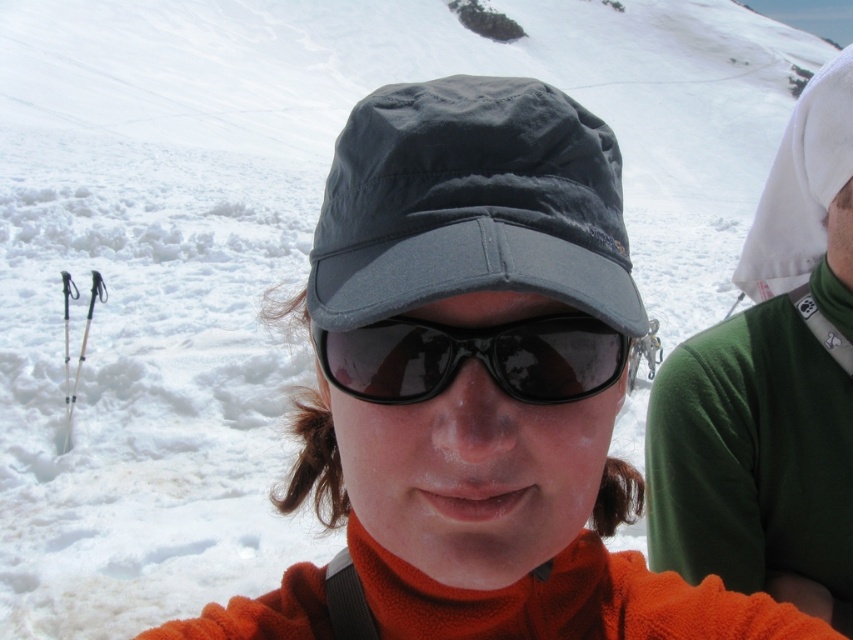
Is green fleece sweater at right positioned at the back of black matte sunglasses at center?

Yes, green fleece sweater at right is further from the viewer.

Which is below, green fleece sweater at right or black matte sunglasses at center?

Positioned lower is black matte sunglasses at center.

Between point (840, 401) and point (428, 333), which one is positioned behind?

Positioned behind is point (840, 401).

Locate an element on the screen. This screenshot has height=640, width=853. green fleece sweater at right is located at coordinates (770, 388).